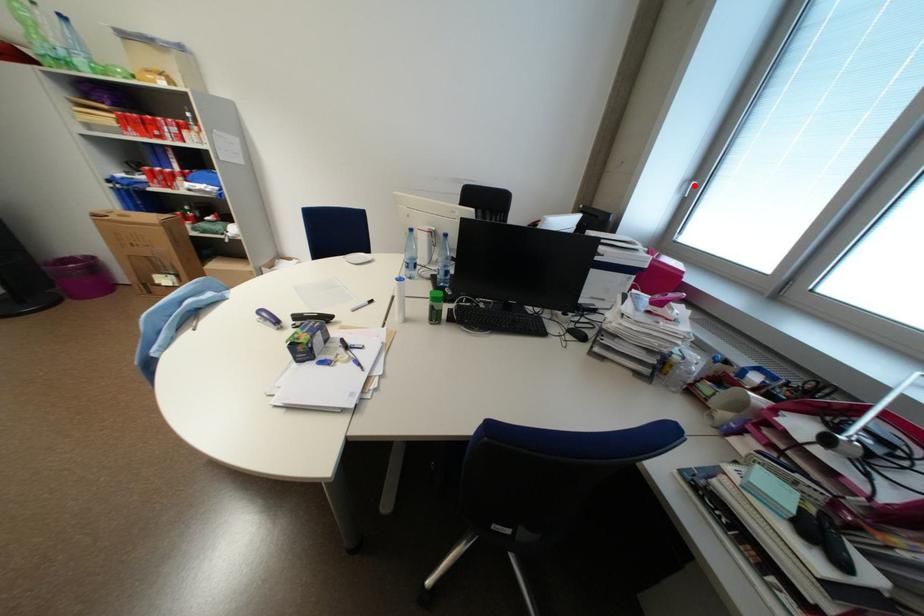
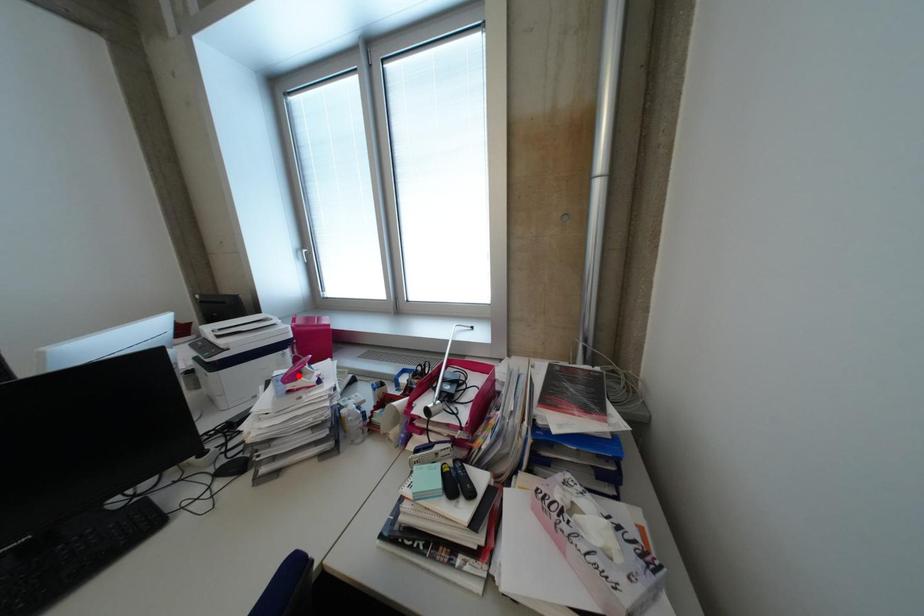
I am providing you with two images of the same scene from different viewpoints. A red point is marked on the first image and another point is marked on the second image. Is the red point in image1 aligned with the point shown in image2?

No